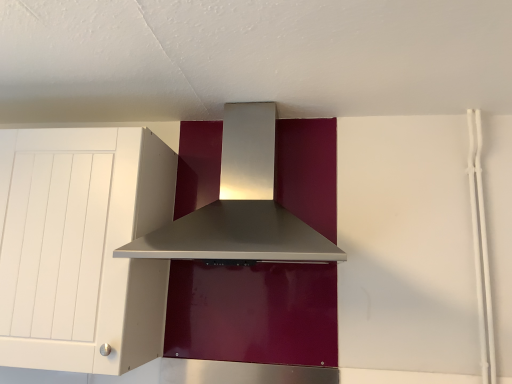
What do you see at coordinates (240, 206) in the screenshot? The image size is (512, 384). I see `satin silver range hood at center` at bounding box center [240, 206].

Where is `satin silver range hood at center`? Image resolution: width=512 pixels, height=384 pixels. satin silver range hood at center is located at coordinates (240, 206).

At what (x,y) coordinates should I click in order to perform the action: click on white matte cabinet at left. Please return your answer as a coordinate pair (x, y). The width and height of the screenshot is (512, 384). Looking at the image, I should click on (105, 249).

What do you see at coordinates (105, 249) in the screenshot? I see `white matte cabinet at left` at bounding box center [105, 249].

The width and height of the screenshot is (512, 384). Identify the location of satin silver range hood at center. (240, 206).

In the image, is satin silver range hood at center on the left side or the right side of white matte cabinet at left?

In the image, satin silver range hood at center appears on the right side of white matte cabinet at left.

Which is behind, satin silver range hood at center or white matte cabinet at left?

white matte cabinet at left is behind.

Which is behind, point (196, 218) or point (18, 175)?

The point (196, 218) is behind.

From the image's perspective, between satin silver range hood at center and white matte cabinet at left, who is located below?

white matte cabinet at left appears lower in the image.

From a real-world perspective, who is located higher, satin silver range hood at center or white matte cabinet at left?

satin silver range hood at center is physically above.

Considering the sizes of satin silver range hood at center and white matte cabinet at left in the image, is satin silver range hood at center wider or thinner than white matte cabinet at left?

Clearly, satin silver range hood at center has more width compared to white matte cabinet at left.

Considering the relative sizes of satin silver range hood at center and white matte cabinet at left in the image provided, is satin silver range hood at center taller than white matte cabinet at left?

No, satin silver range hood at center is not taller than white matte cabinet at left.

Is satin silver range hood at center bigger or smaller than white matte cabinet at left?

Considering their sizes, satin silver range hood at center takes up less space than white matte cabinet at left.

Is white matte cabinet at left surrounded by satin silver range hood at center?

No.

Would you say satin silver range hood at center is a long distance from white matte cabinet at left?

satin silver range hood at center is near white matte cabinet at left, not far away.

Is satin silver range hood at center facing away from white matte cabinet at left?

No, satin silver range hood at center is not facing the opposite direction of white matte cabinet at left.

At what (x,y) coordinates should I click in order to perform the action: click on cabinetry lying behind the satin silver range hood at center. Please return your answer as a coordinate pair (x, y). The height and width of the screenshot is (384, 512). Looking at the image, I should click on (105, 249).

Does white matte cabinet at left appear on the right side of satin silver range hood at center?

In fact, white matte cabinet at left is to the left of satin silver range hood at center.

Is white matte cabinet at left positioned in front of satin silver range hood at center?

No, the depth of white matte cabinet at left is greater than that of satin silver range hood at center.

Does point (87, 223) come farther from viewer compared to point (220, 218)?

No, it is not.

From the image's perspective, which one is positioned higher, white matte cabinet at left or satin silver range hood at center?

satin silver range hood at center.

From a real-world perspective, is white matte cabinet at left located higher than satin silver range hood at center?

No, from a real-world perspective, white matte cabinet at left is not over satin silver range hood at center

Considering the relative sizes of white matte cabinet at left and satin silver range hood at center in the image provided, is white matte cabinet at left thinner than satin silver range hood at center?

Correct, the width of white matte cabinet at left is less than that of satin silver range hood at center.

Does white matte cabinet at left have a lesser height compared to satin silver range hood at center?

Incorrect, the height of white matte cabinet at left does not fall short of that of satin silver range hood at center.

Is white matte cabinet at left bigger or smaller than satin silver range hood at center?

In the image, white matte cabinet at left appears to be larger than satin silver range hood at center.

Would you say white matte cabinet at left is inside or outside satin silver range hood at center?

white matte cabinet at left exists outside the volume of satin silver range hood at center.

Is white matte cabinet at left far from satin silver range hood at center?

They are positioned close to each other.

Could you tell me if white matte cabinet at left is turned towards satin silver range hood at center?

No, white matte cabinet at left is not turned towards satin silver range hood at center.

What's the angular difference between white matte cabinet at left and satin silver range hood at center's facing directions?

There is a 1.49-degree angle between the facing directions of white matte cabinet at left and satin silver range hood at center.

Measure the distance from white matte cabinet at left to satin silver range hood at center.

white matte cabinet at left is 10.15 inches away from satin silver range hood at center.

Where is `home appliance lying in front of the white matte cabinet at left`? home appliance lying in front of the white matte cabinet at left is located at coordinates (240, 206).

At what (x,y) coordinates should I click in order to perform the action: click on home appliance that appears in front of the white matte cabinet at left. Please return your answer as a coordinate pair (x, y). Looking at the image, I should click on (240, 206).

At what (x,y) coordinates should I click in order to perform the action: click on home appliance on the right of white matte cabinet at left. Please return your answer as a coordinate pair (x, y). Looking at the image, I should click on (240, 206).